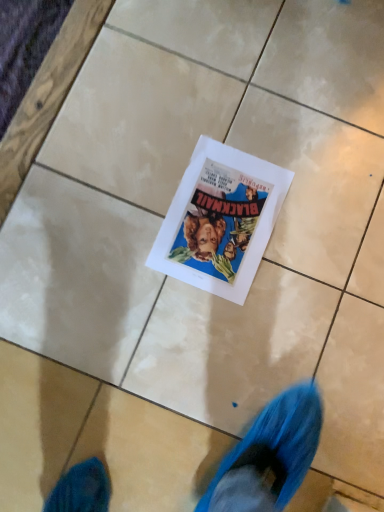
Locate an element on the screen. The height and width of the screenshot is (512, 384). free spot behind matte paper poster at center is located at coordinates (250, 112).